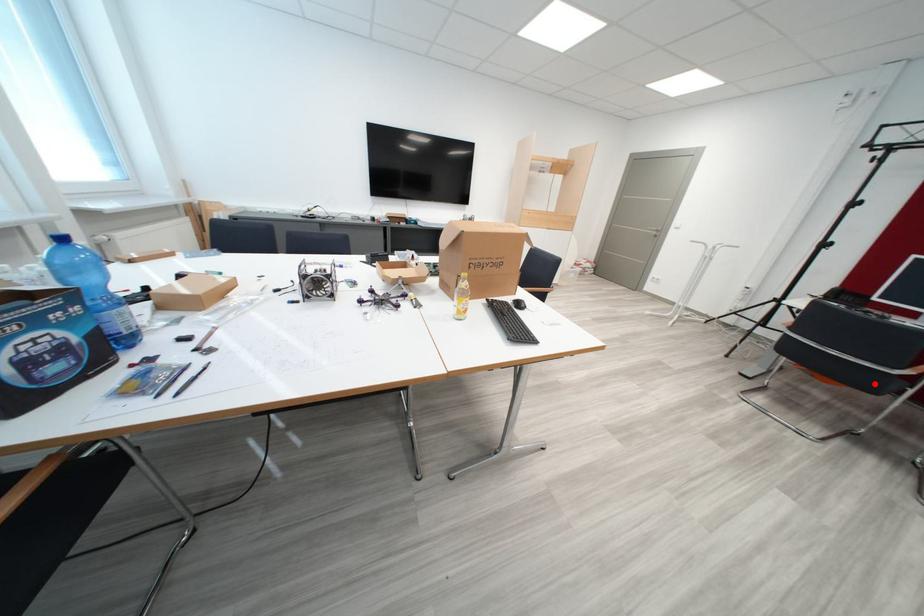
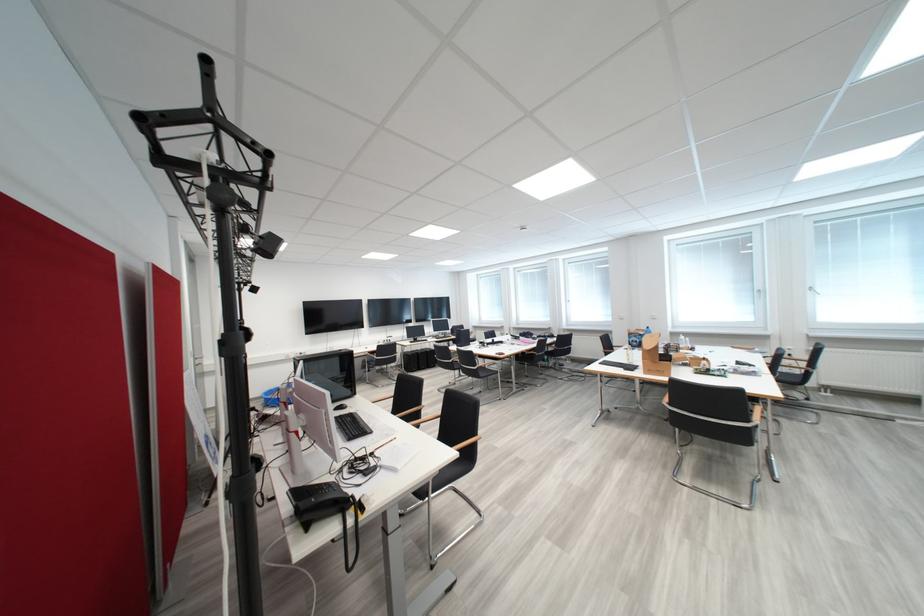
Question: I am providing you with two images of the same scene from different viewpoints. A red point is marked on the first image. Can you still see the location of the red point in image 2?

Choices:
 (A) Yes
 (B) No

Answer: (B)